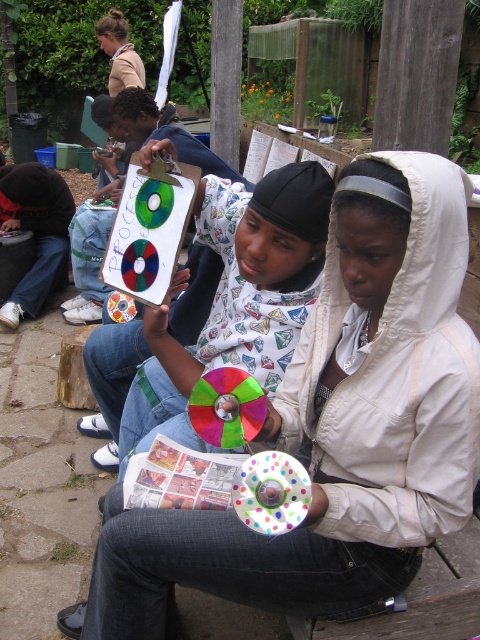
You are an artist trying to decide which item to use for a project. The scene shows a white matte hoodie at center and a matte plastic cd at center. Which object is bigger in size?

The white matte hoodie at center is larger in size than the matte plastic cd at center.

You are a photographer trying to capture both the white matte hoodie at center and the matte plastic cd at center in a single frame. Which object should you focus on first to ensure both are in focus, considering their sizes?

The white matte hoodie at center is much taller than the matte plastic cd at center, so focusing on the larger object first would help ensure both are in focus.

You are standing in the garden scene described. There is a point marked at coordinates (336, 426). What object is located at that point?

The point at coordinates (336, 426) indicates the white matte hoodie at center.